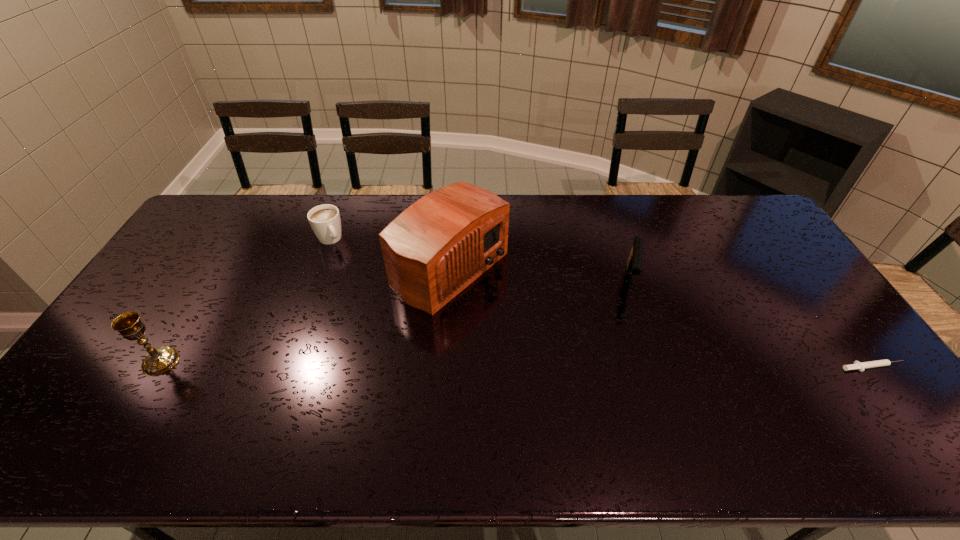
In order to click on free area in between the rightmost object and the radio receiver in this screenshot , I will do `click(661, 318)`.

You are a GUI agent. You are given a task and a screenshot of the screen. Output one action in this format:
    pyautogui.click(x=<x>, y=<y>)
    Task: Click on the free space between the cappuccino and the chalice
    This screenshot has width=960, height=540.
    Given the screenshot: What is the action you would take?
    pyautogui.click(x=245, y=300)

This screenshot has height=540, width=960. Identify the location of free spot between the radio receiver and the second tallest object. (305, 315).

The height and width of the screenshot is (540, 960). I want to click on free spot between the shortest object and the leftmost object, so click(517, 364).

The image size is (960, 540). In order to click on vacant space that's between the syringe and the radio receiver in this screenshot , I will do `click(661, 318)`.

Find the location of a particular element. free space that is in between the rightmost object and the second object from left to right is located at coordinates (601, 303).

Where is `free space between the rightmost object and the pistol`? The height and width of the screenshot is (540, 960). free space between the rightmost object and the pistol is located at coordinates click(751, 324).

Where is `unoccupied position between the leftmost object and the shortest object`? unoccupied position between the leftmost object and the shortest object is located at coordinates (517, 364).

Find the location of a particular element. The width and height of the screenshot is (960, 540). vacant space in between the third shortest object and the second tallest object is located at coordinates (x=395, y=321).

Where is `object that is the closest to the third object from left to right`? Image resolution: width=960 pixels, height=540 pixels. object that is the closest to the third object from left to right is located at coordinates (325, 221).